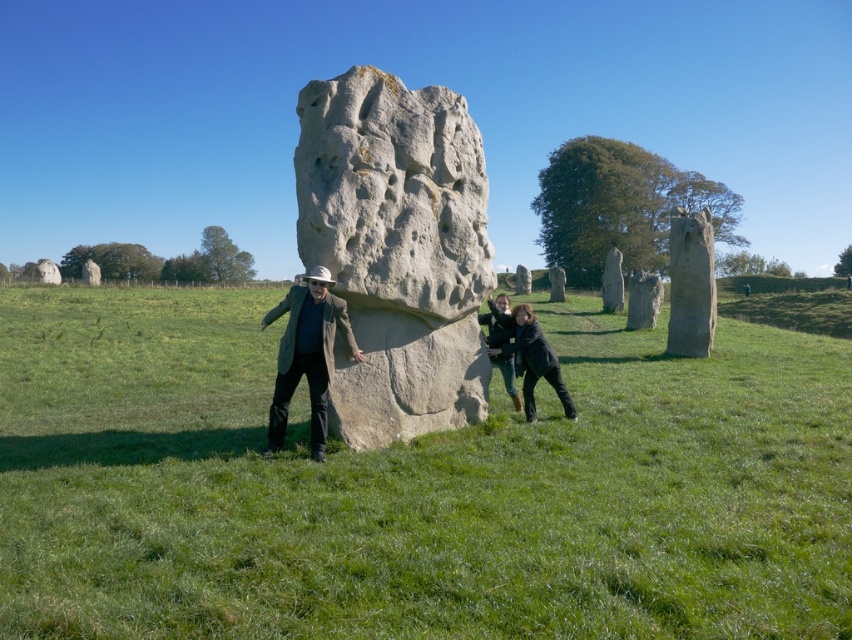
Question: Is matte gray coat at center smaller than dark gray jacket at center?

Choices:
 (A) no
 (B) yes

Answer: (B)

Question: Does green grassy at center appear on the left side of smooth stone monolith at center-right?

Choices:
 (A) no
 (B) yes

Answer: (B)

Question: Which point appears closest to the camera in this image?

Choices:
 (A) (672, 253)
 (B) (320, 388)

Answer: (B)

Question: Which point appears farthest from the camera in this image?

Choices:
 (A) (619, 257)
 (B) (712, 285)

Answer: (A)

Question: Is green grassy at center below dark green jacket at center?

Choices:
 (A) yes
 (B) no

Answer: (B)

Question: Among these objects, which one is farthest from the camera?

Choices:
 (A) dark green jacket at center
 (B) smooth gray stone at right
 (C) green grassy at center
 (D) gray rough stone at center

Answer: (B)